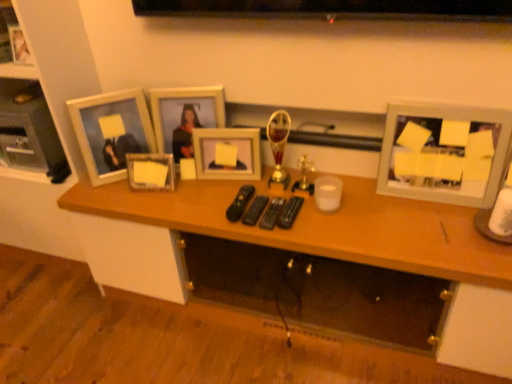
In order to click on vacant space that's between wooden picture frame at center, the 4th picture frame in the right-to-left sequence, and black plastic remote control at center, which appears as the 2th remote control when viewed from the left in this screenshot , I will do `click(195, 195)`.